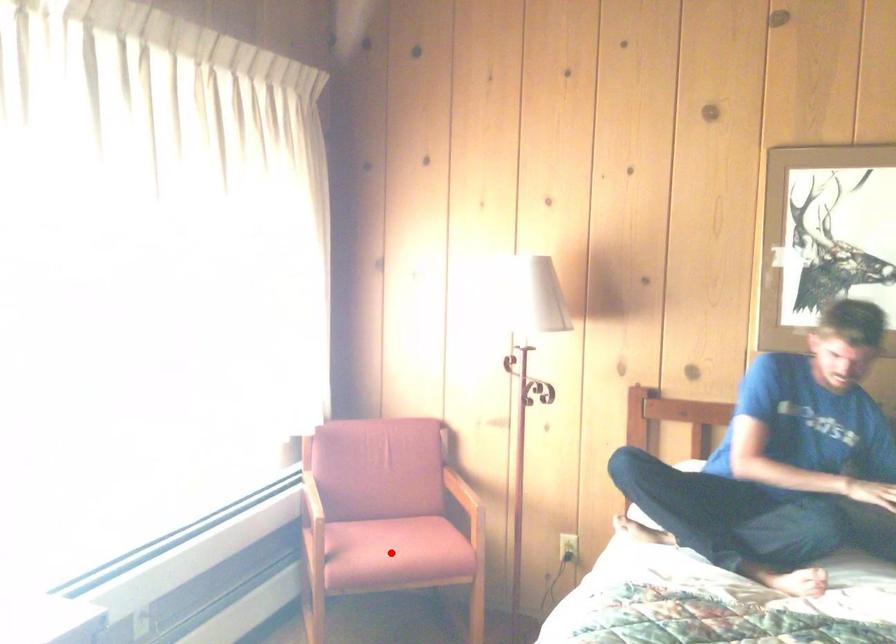
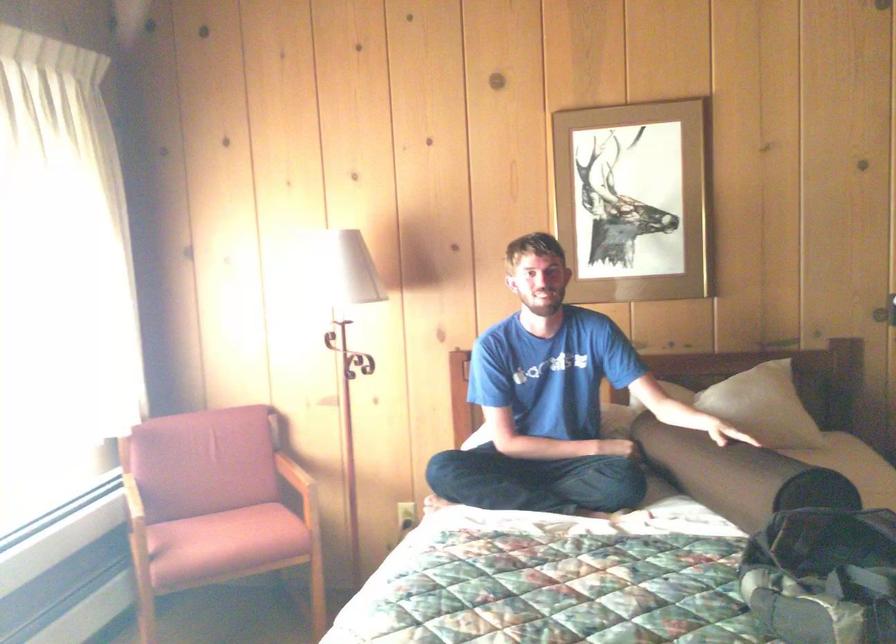
Find the pixel in the second image that matches the highlighted location in the first image.

(224, 543)